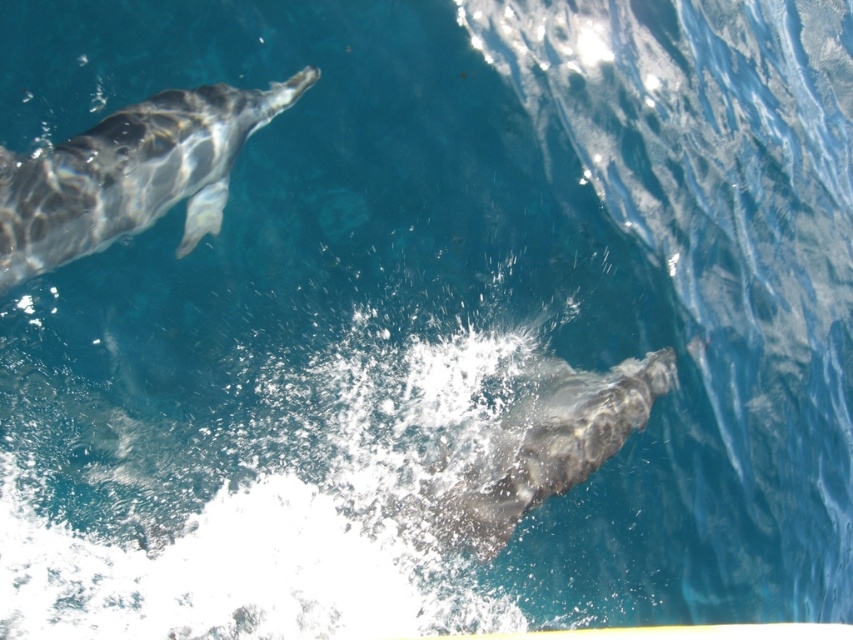
Is point (19, 196) farther from camera compared to point (585, 392)?

No, it is in front of (585, 392).

Which is more to the right, gray shiny dolphin at upper left or gray textured dolphin at lower right?

gray textured dolphin at lower right

The image size is (853, 640). I want to click on gray shiny dolphin at upper left, so click(x=131, y=173).